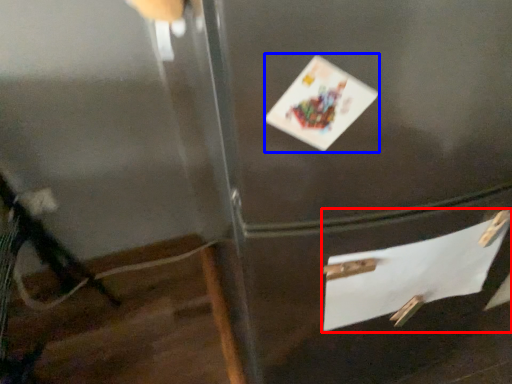
Question: Which point is further to the camera, drawer (highlighted by a red box) or postcard (highlighted by a blue box)?

Choices:
 (A) drawer
 (B) postcard

Answer: (A)